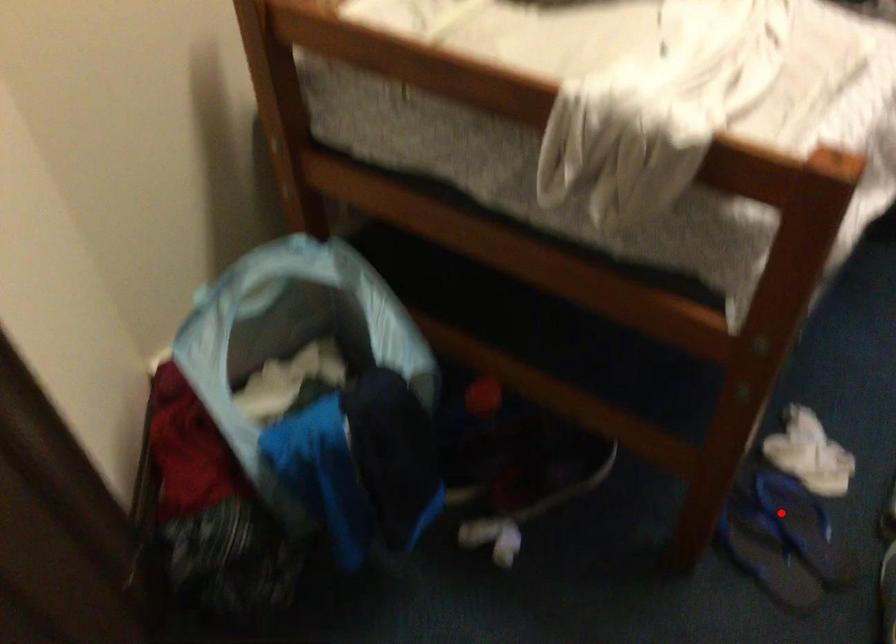
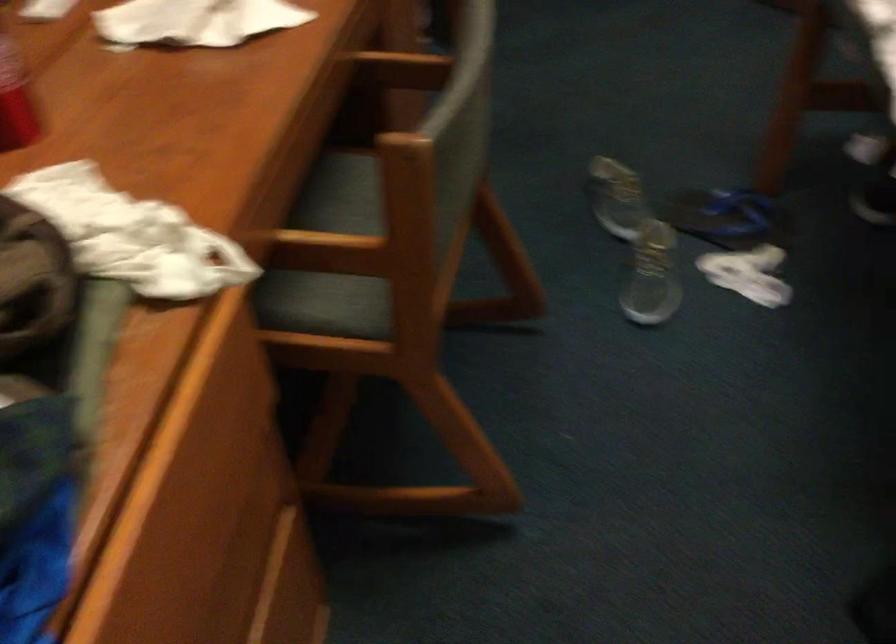
Question: I am providing you with two images of the same scene from different viewpoints. In image1, a red point is highlighted. Considering the same 3D point in image2, which of the following is correct?

Choices:
 (A) It is closer
 (B) It is farther

Answer: (B)